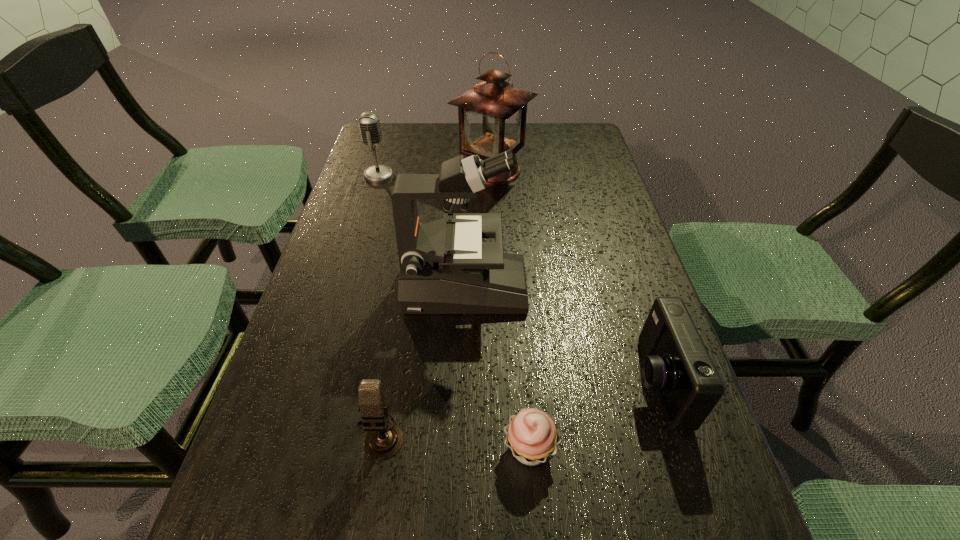
Locate an element on the screen. This screenshot has width=960, height=540. vacant space positioned on the front of the farther microphone is located at coordinates (356, 249).

Locate an element on the screen. Image resolution: width=960 pixels, height=540 pixels. free location located on the front-facing side of the right microphone is located at coordinates (368, 507).

The height and width of the screenshot is (540, 960). I want to click on vacant space positioned 0.110m on the front-facing side of the camera, so click(573, 382).

Image resolution: width=960 pixels, height=540 pixels. What are the coordinates of `free spot located on the front-facing side of the camera` in the screenshot? It's located at (584, 382).

In order to click on free space located 0.350m on the front-facing side of the camera in this screenshot , I will do `click(443, 382)`.

Where is `blank space located 0.120m on the back of the shortest object`? blank space located 0.120m on the back of the shortest object is located at coordinates (523, 363).

This screenshot has width=960, height=540. Find the location of `object that is at the far edge`. object that is at the far edge is located at coordinates (492, 114).

I want to click on object that is at the left edge, so click(x=369, y=124).

Where is `object that is at the right edge`? The height and width of the screenshot is (540, 960). object that is at the right edge is located at coordinates (676, 363).

In the image, there is a desktop. Find the location of `vacant space at the far edge`. vacant space at the far edge is located at coordinates (529, 159).